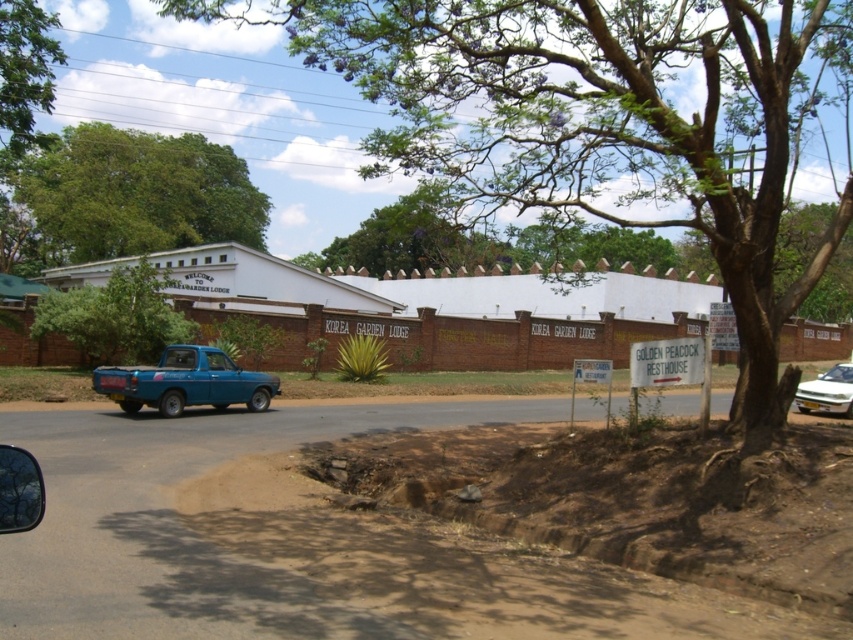
You are a delivery driver who needs to park your white glossy car at right closer to the green leafy tree at center. Considering their sizes, can you position the car so that it doesn not block the tree from view for someone standing at the entrance of the building?

The green leafy tree at center is smaller than the white glossy car at right, so positioning the car closer to the tree might block its view. To avoid blocking the tree, park the car at a distance where the larger car does not obscure the smaller tree from the entrance viewpoint.